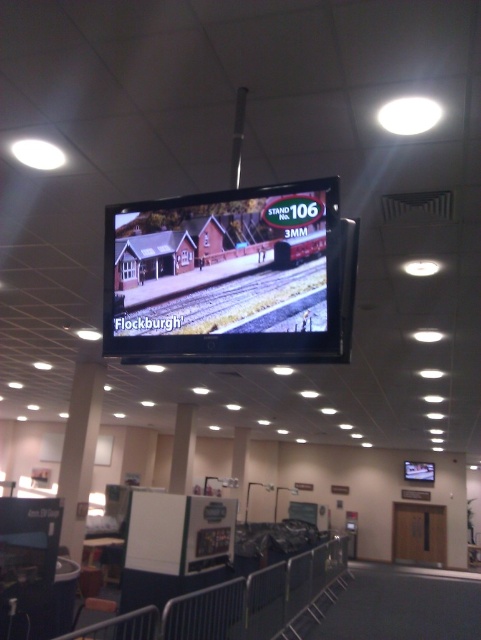
Measure the distance from matte black screen at center to brown gravel train track at center.

9.90 centimeters

Who is lower down, matte black screen at center or brown gravel train track at center?

brown gravel train track at center is lower down.

Between point (207, 256) and point (302, 308), which one is positioned in front?

Point (302, 308) is more forward.

Where is `matte black screen at center`? The width and height of the screenshot is (481, 640). matte black screen at center is located at coordinates (225, 275).